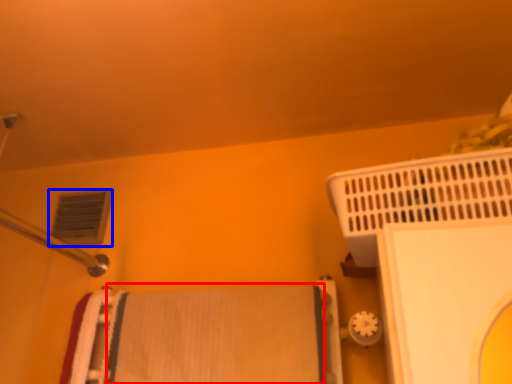
Question: Among these objects, which one is farthest to the camera, bath towel (highlighted by a red box) or air conditioning (highlighted by a blue box)?

Choices:
 (A) bath towel
 (B) air conditioning

Answer: (B)